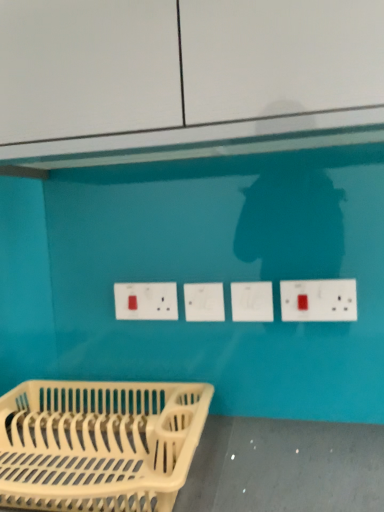
Question: Considering the relative sizes of white plastic socket at center, arranged as the 1th socket when viewed from the left, and white plastic electrical outlet at center, which is the first electric outlet in back-to-front order, in the image provided, is white plastic socket at center, arranged as the 1th socket when viewed from the left, taller than white plastic electrical outlet at center, which is the first electric outlet in back-to-front order,?

Choices:
 (A) no
 (B) yes

Answer: (A)

Question: Is white plastic socket at center, arranged as the 1th socket when viewed from the left, further to the viewer compared to white plastic electrical outlet at center, marked as the second electric outlet in a right-to-left arrangement?

Choices:
 (A) yes
 (B) no

Answer: (B)

Question: Does white plastic socket at center, arranged as the 1th socket when viewed from the left, turn towards white plastic electrical outlet at center, placed as the second electric outlet when sorted from front to back?

Choices:
 (A) yes
 (B) no

Answer: (B)

Question: From the image's perspective, is white plastic socket at center, the 2th socket positioned from the right, above white plastic electrical outlet at center, marked as the second electric outlet in a right-to-left arrangement?

Choices:
 (A) yes
 (B) no

Answer: (B)

Question: Can you confirm if white plastic socket at center, the 2th socket positioned from the right, is shorter than white plastic electrical outlet at center, which is the first electric outlet in back-to-front order?

Choices:
 (A) yes
 (B) no

Answer: (A)

Question: Considering the positions of white plastic socket at center, the 1th socket viewed from the right, and white plastic socket at center, the 2th socket positioned from the right, in the image, is white plastic socket at center, the 1th socket viewed from the right, wider or thinner than white plastic socket at center, the 2th socket positioned from the right,?

Choices:
 (A) thin
 (B) wide

Answer: (A)

Question: From a real-world perspective, is white plastic socket at center, the 1th socket viewed from the right, physically located above or below white plastic socket at center, the 2th socket positioned from the right?

Choices:
 (A) above
 (B) below

Answer: (B)

Question: In terms of height, does white plastic socket at center, the 1th socket viewed from the right, look taller or shorter compared to white plastic socket at center, arranged as the 1th socket when viewed from the left?

Choices:
 (A) short
 (B) tall

Answer: (A)

Question: Visually, is white plastic socket at center, which is the 2th socket in left-to-right order, positioned to the left or to the right of white plastic socket at center, the 2th socket positioned from the right?

Choices:
 (A) right
 (B) left

Answer: (A)

Question: From a real-world perspective, is white plastic dish rack at lower left above or below white plastic socket at center, the 1th socket viewed from the right?

Choices:
 (A) below
 (B) above

Answer: (A)

Question: From their relative heights in the image, would you say white plastic dish rack at lower left is taller or shorter than white plastic socket at center, the 1th socket viewed from the right?

Choices:
 (A) short
 (B) tall

Answer: (B)

Question: Is white plastic dish rack at lower left to the left or to the right of white plastic socket at center, the 1th socket viewed from the right, in the image?

Choices:
 (A) left
 (B) right

Answer: (A)

Question: Considering the positions of white plastic dish rack at lower left and white plastic socket at center, the 1th socket viewed from the right, in the image, is white plastic dish rack at lower left bigger or smaller than white plastic socket at center, the 1th socket viewed from the right,?

Choices:
 (A) big
 (B) small

Answer: (A)

Question: From a real-world perspective, is white plastic socket at center, the 2th socket positioned from the right, physically located above or below white plastic socket at center, the 1th socket viewed from the right?

Choices:
 (A) above
 (B) below

Answer: (A)

Question: Is white plastic socket at center, arranged as the 1th socket when viewed from the left, wider or thinner than white plastic socket at center, which is the 2th socket in left-to-right order?

Choices:
 (A) thin
 (B) wide

Answer: (B)